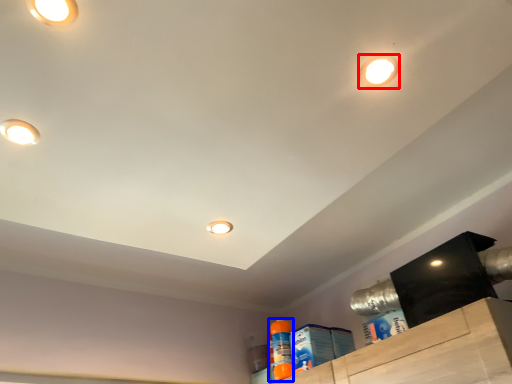
Question: Which of the following is the farthest to the observer, droplight (highlighted by a red box) or cleaning product (highlighted by a blue box)?

Choices:
 (A) droplight
 (B) cleaning product

Answer: (B)